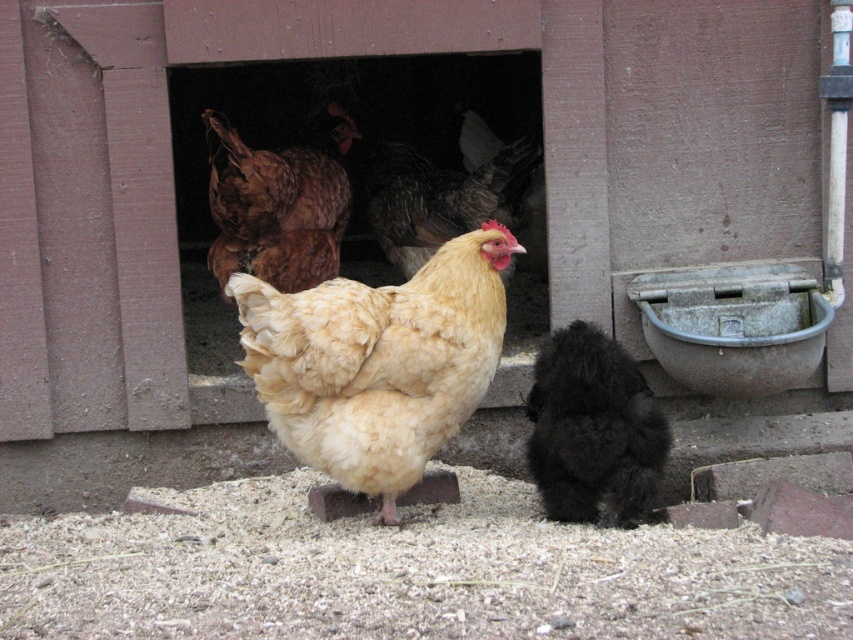
Question: In this image, where is black fluffy chicken at lower center located relative to brown feathered chicken at center?

Choices:
 (A) below
 (B) above

Answer: (A)

Question: Can you confirm if black fluffy chicken at lower center is positioned below brown feathered chicken at center?

Choices:
 (A) yes
 (B) no

Answer: (A)

Question: Which point is farther to the camera?

Choices:
 (A) (402, 196)
 (B) (576, 468)
 (C) (263, 179)

Answer: (A)

Question: Which object is the closest to the brown feathered chicken at upper center?

Choices:
 (A) golden feathered chicken at center
 (B) black fluffy chicken at lower center
 (C) brown feathered chicken at center

Answer: (C)

Question: Which is nearer to the brown feathered chicken at center?

Choices:
 (A) brown feathered chicken at upper center
 (B) golden feathered chicken at center

Answer: (A)

Question: Is golden feathered chicken at center positioned at the back of brown feathered chicken at center?

Choices:
 (A) yes
 (B) no

Answer: (B)